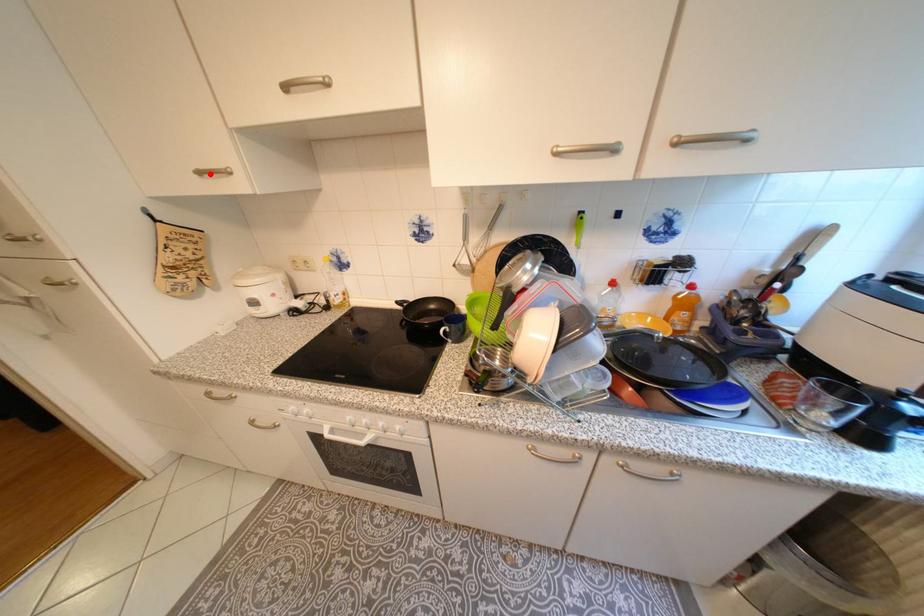
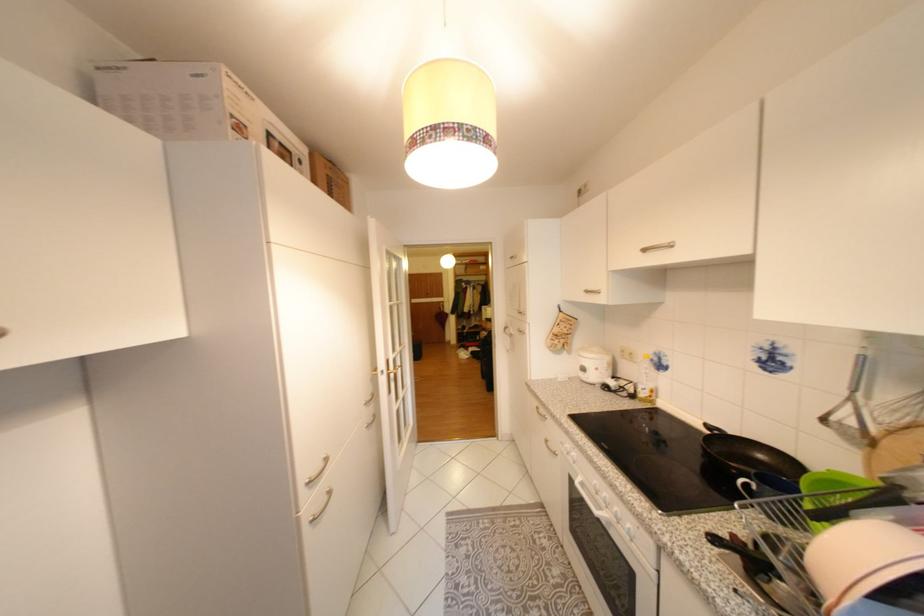
In the second image, find the point that corresponds to the highlighted location in the first image.

(596, 292)